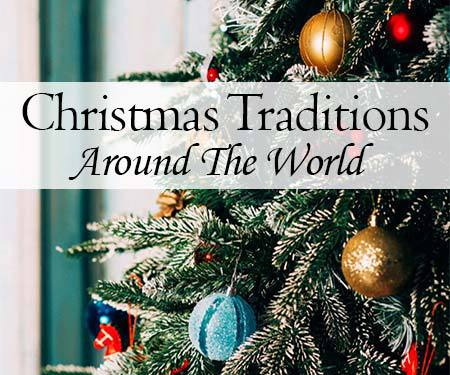
Find the location of `red sock`. red sock is located at coordinates (109, 338).